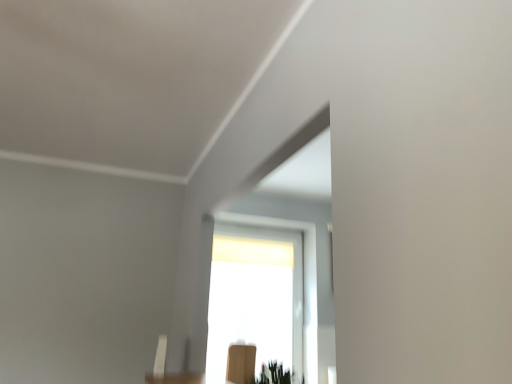
Question: In terms of width, does green matte plant at lower center look wider or thinner when compared to transparent glass window at center?

Choices:
 (A) thin
 (B) wide

Answer: (B)

Question: Considering the positions of green matte plant at lower center and transparent glass window at center in the image, is green matte plant at lower center bigger or smaller than transparent glass window at center?

Choices:
 (A) small
 (B) big

Answer: (A)

Question: Which is farther from the wooden chair at lower center?

Choices:
 (A) transparent glass window at center
 (B) green matte plant at lower center

Answer: (B)

Question: Which is farther from the transparent glass window at center?

Choices:
 (A) wooden chair at lower center
 (B) green matte plant at lower center

Answer: (B)